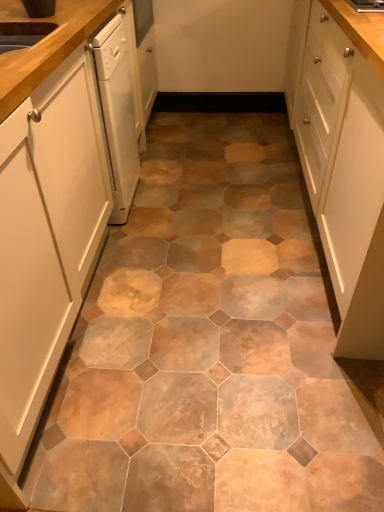
Question: From a real-world perspective, does white matte cabinet at left, the 2th cabinetry positioned from the right, stand above white matte cabinet at right, positioned as the 2th cabinetry in left-to-right order?

Choices:
 (A) yes
 (B) no

Answer: (B)

Question: Is white matte cabinet at right, positioned as the 2th cabinetry in left-to-right order, at the back of white matte cabinet at left, the 2th cabinetry positioned from the right?

Choices:
 (A) yes
 (B) no

Answer: (B)

Question: Does white matte cabinet at left, arranged as the first cabinetry when viewed from the left, have a lesser height compared to white matte cabinet at right, positioned as the 2th cabinetry in left-to-right order?

Choices:
 (A) no
 (B) yes

Answer: (A)

Question: Does white matte cabinet at left, arranged as the first cabinetry when viewed from the left, touch white matte cabinet at right, positioned as the 2th cabinetry in left-to-right order?

Choices:
 (A) no
 (B) yes

Answer: (A)

Question: From a real-world perspective, is white matte cabinet at left, arranged as the first cabinetry when viewed from the left, beneath white matte cabinet at right, positioned as the first cabinetry in right-to-left order?

Choices:
 (A) no
 (B) yes

Answer: (B)

Question: From the image's perspective, is white matte cabinet at left, arranged as the first cabinetry when viewed from the left, located beneath white matte cabinet at right, positioned as the 2th cabinetry in left-to-right order?

Choices:
 (A) no
 (B) yes

Answer: (B)

Question: Are white matte cabinet at right, positioned as the 2th cabinetry in left-to-right order, and white matte cabinet at left, arranged as the first cabinetry when viewed from the left, located far from each other?

Choices:
 (A) no
 (B) yes

Answer: (A)

Question: Is white matte cabinet at right, positioned as the 2th cabinetry in left-to-right order, at the left side of white matte cabinet at left, the 2th cabinetry positioned from the right?

Choices:
 (A) no
 (B) yes

Answer: (A)

Question: Considering the relative sizes of white matte cabinet at right, positioned as the first cabinetry in right-to-left order, and white matte cabinet at left, arranged as the first cabinetry when viewed from the left, in the image provided, is white matte cabinet at right, positioned as the first cabinetry in right-to-left order, smaller than white matte cabinet at left, arranged as the first cabinetry when viewed from the left,?

Choices:
 (A) yes
 (B) no

Answer: (B)

Question: Considering the relative positions of white matte cabinet at right, positioned as the 2th cabinetry in left-to-right order, and white matte cabinet at left, the 2th cabinetry positioned from the right, in the image provided, is white matte cabinet at right, positioned as the 2th cabinetry in left-to-right order, behind white matte cabinet at left, the 2th cabinetry positioned from the right,?

Choices:
 (A) yes
 (B) no

Answer: (A)

Question: From a real-world perspective, is white matte cabinet at right, positioned as the 2th cabinetry in left-to-right order, positioned under white matte cabinet at left, arranged as the first cabinetry when viewed from the left, based on gravity?

Choices:
 (A) yes
 (B) no

Answer: (B)

Question: Does white matte cabinet at right, positioned as the 2th cabinetry in left-to-right order, contain white matte cabinet at left, the 2th cabinetry positioned from the right?

Choices:
 (A) no
 (B) yes

Answer: (A)

Question: Based on their sizes in the image, would you say white matte cabinet at right, positioned as the first cabinetry in right-to-left order, is bigger or smaller than white matte cabinet at left, arranged as the first cabinetry when viewed from the left?

Choices:
 (A) big
 (B) small

Answer: (A)